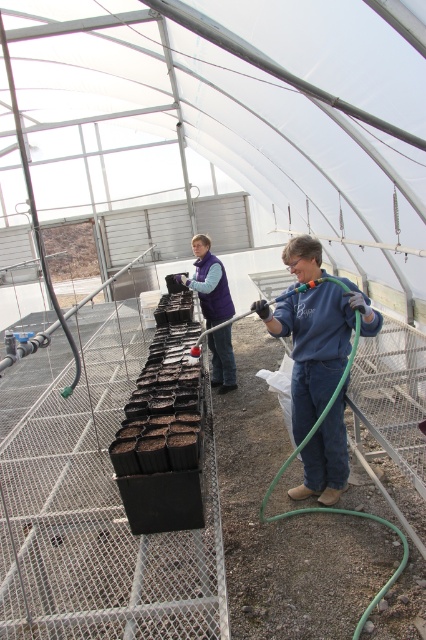
Question: Is blue fleece jacket at right below purple fleece vest at center?

Choices:
 (A) yes
 (B) no

Answer: (A)

Question: Among these objects, which one is farthest from the camera?

Choices:
 (A) blue fleece jacket at right
 (B) purple fleece vest at center

Answer: (B)

Question: Is blue fleece jacket at right in front of purple fleece vest at center?

Choices:
 (A) no
 (B) yes

Answer: (B)

Question: Which object appears closest to the camera in this image?

Choices:
 (A) purple fleece vest at center
 (B) blue fleece jacket at right

Answer: (B)

Question: Is blue fleece jacket at right thinner than purple fleece vest at center?

Choices:
 (A) no
 (B) yes

Answer: (A)